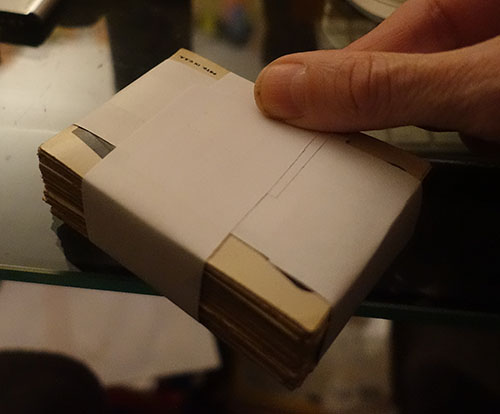
At what (x,y) coordinates should I click in order to perform the action: click on flat surface. Please return your answer as a coordinate pair (x, y). The width and height of the screenshot is (500, 414). Looking at the image, I should click on (34, 117), (228, 50).